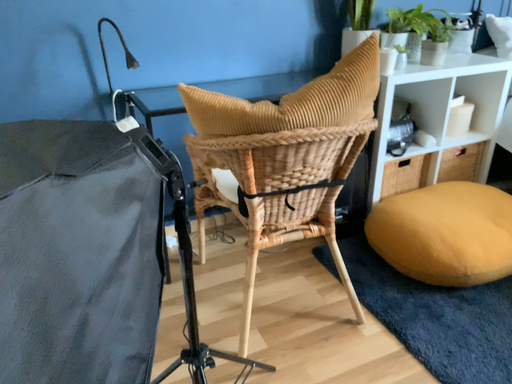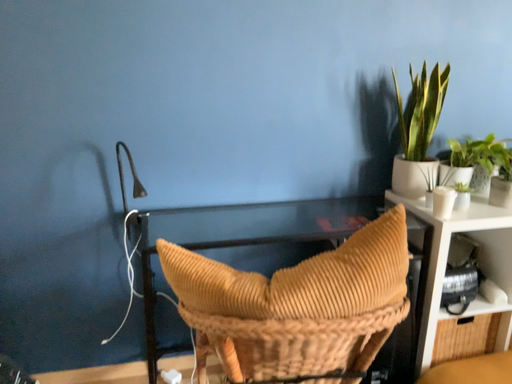
Question: How did the camera likely rotate when shooting the video?

Choices:
 (A) rotated right
 (B) rotated left

Answer: (B)